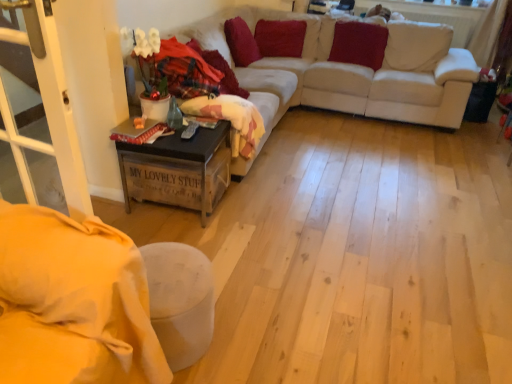
This screenshot has width=512, height=384. What do you see at coordinates (359, 44) in the screenshot? I see `velvet red pillow at upper right, the 1th pillow positioned from the right` at bounding box center [359, 44].

The width and height of the screenshot is (512, 384). What do you see at coordinates (230, 117) in the screenshot?
I see `fluffy pink blanket at center` at bounding box center [230, 117].

What do you see at coordinates (280, 37) in the screenshot? This screenshot has width=512, height=384. I see `velvet red pillow at upper center, the 2th pillow positioned from the left` at bounding box center [280, 37].

At what (x,y) coordinates should I click in order to perform the action: click on white plastic screen door at lower left. Please return your answer as a coordinate pair (x, y). This screenshot has height=384, width=512. Looking at the image, I should click on (47, 108).

Is white fabric couch at upper center bigger than velvet red pillow at upper center, which ranks as the second pillow in right-to-left order?

Yes, white fabric couch at upper center is bigger than velvet red pillow at upper center, which ranks as the second pillow in right-to-left order.

From a real-world perspective, is white fabric couch at upper center located higher than velvet red pillow at upper center, which ranks as the second pillow in right-to-left order?

No.

Between white fabric couch at upper center and velvet red pillow at upper center, the 2th pillow positioned from the left, which one has larger width?

With larger width is white fabric couch at upper center.

Is velvet red pillow at upper center, which is the 1th pillow in left-to-right order, far away from velvet red pillow at upper center, the 2th pillow positioned from the left?

No, velvet red pillow at upper center, which is the 1th pillow in left-to-right order, is in close proximity to velvet red pillow at upper center, the 2th pillow positioned from the left.

Considering the relative sizes of velvet red pillow at upper center, which appears as the 3th pillow when viewed from the right, and velvet red pillow at upper center, which ranks as the second pillow in right-to-left order, in the image provided, is velvet red pillow at upper center, which appears as the 3th pillow when viewed from the right, wider than velvet red pillow at upper center, which ranks as the second pillow in right-to-left order,?

No.

From a real-world perspective, count 2nd pillows downward from the velvet red pillow at upper center, which appears as the 3th pillow when viewed from the right, and point to it. Please provide its 2D coordinates.

[(280, 37)]

Can we say velvet red pillow at upper center, which ranks as the second pillow in right-to-left order, lies outside velvet red pillow at upper center, which is the 1th pillow in left-to-right order?

Indeed, velvet red pillow at upper center, which ranks as the second pillow in right-to-left order, is completely outside velvet red pillow at upper center, which is the 1th pillow in left-to-right order.

Is velvet red pillow at upper center, the 2th pillow positioned from the left, wider than velvet red pillow at upper center, which is the 1th pillow in left-to-right order?

Yes, velvet red pillow at upper center, the 2th pillow positioned from the left, is wider than velvet red pillow at upper center, which is the 1th pillow in left-to-right order.

Is velvet red pillow at upper center, which ranks as the second pillow in right-to-left order, shorter than velvet red pillow at upper center, which is the 1th pillow in left-to-right order?

Indeed, velvet red pillow at upper center, which ranks as the second pillow in right-to-left order, has a lesser height compared to velvet red pillow at upper center, which is the 1th pillow in left-to-right order.

Is velvet red pillow at upper center, the 2th pillow positioned from the left, further to the viewer compared to velvet red pillow at upper center, which is the 1th pillow in left-to-right order?

Yes, velvet red pillow at upper center, the 2th pillow positioned from the left, is further from the camera.

In the scene shown: Considering the sizes of wooden crate at lower left and velvet red pillow at upper center, which is the 1th pillow in left-to-right order, in the image, is wooden crate at lower left wider or thinner than velvet red pillow at upper center, which is the 1th pillow in left-to-right order,?

In the image, wooden crate at lower left appears to be wider than velvet red pillow at upper center, which is the 1th pillow in left-to-right order.

From a real-world perspective, between wooden crate at lower left and velvet red pillow at upper center, which is the 1th pillow in left-to-right order, who is vertically lower?

From a 3D spatial view, wooden crate at lower left is below.

How far apart are wooden crate at lower left and velvet red pillow at upper center, which is the 1th pillow in left-to-right order?

wooden crate at lower left is 5.85 feet from velvet red pillow at upper center, which is the 1th pillow in left-to-right order.

At what (x,y) coordinates should I click in order to perform the action: click on pillow that is the 2nd one when counting upward from the wooden crate at lower left (from the image's perspective). Please return your answer as a coordinate pair (x, y). This screenshot has width=512, height=384. Looking at the image, I should click on (241, 42).

Is point (190, 112) positioned behind point (245, 46)?

That is False.

How different are the orientations of fluffy pink blanket at center and velvet red pillow at upper center, which appears as the 3th pillow when viewed from the right, in degrees?

The angle between the facing direction of fluffy pink blanket at center and the facing direction of velvet red pillow at upper center, which appears as the 3th pillow when viewed from the right, is 1.87 degrees.

Considering the sizes of objects fluffy pink blanket at center and velvet red pillow at upper center, which is the 1th pillow in left-to-right order, in the image provided, who is shorter, fluffy pink blanket at center or velvet red pillow at upper center, which is the 1th pillow in left-to-right order,?

Standing shorter between the two is fluffy pink blanket at center.

Consider the image. Is fluffy pink blanket at center positioned with its back to velvet red pillow at upper center, which appears as the 3th pillow when viewed from the right?

fluffy pink blanket at center is not turned away from velvet red pillow at upper center, which appears as the 3th pillow when viewed from the right.

Is velvet red pillow at upper right, the 1th pillow positioned from the right, to the left of fluffy pink blanket at center from the viewer's perspective?

Incorrect, velvet red pillow at upper right, the 1th pillow positioned from the right, is not on the left side of fluffy pink blanket at center.

From a real-world perspective, is velvet red pillow at upper right, the 1th pillow positioned from the right, positioned above or below fluffy pink blanket at center?

In terms of real-world spatial position, velvet red pillow at upper right, the 1th pillow positioned from the right, is above fluffy pink blanket at center.

Between velvet red pillow at upper right, the 3th pillow in the left-to-right sequence, and fluffy pink blanket at center, which one has larger width?

fluffy pink blanket at center is wider.

Is point (344, 22) positioned before point (240, 128)?

No, (344, 22) is further to viewer.

Which is behind, velvet red pillow at upper right, the 1th pillow positioned from the right, or white fabric couch at upper center?

Positioned behind is velvet red pillow at upper right, the 1th pillow positioned from the right.

From a real-world perspective, who is located lower, velvet red pillow at upper right, the 1th pillow positioned from the right, or white fabric couch at upper center?

white fabric couch at upper center, from a real-world perspective.

Is velvet red pillow at upper right, the 3th pillow in the left-to-right sequence, next to white fabric couch at upper center and touching it?

No, velvet red pillow at upper right, the 3th pillow in the left-to-right sequence, is not making contact with white fabric couch at upper center.

Which point is more distant from viewer, (353, 40) or (381, 75)?

Positioned behind is point (353, 40).

Locate an element on the screen. Image resolution: width=512 pixels, height=384 pixels. couch below the velvet red pillow at upper center, which ranks as the second pillow in right-to-left order (from a real-world perspective) is located at coordinates (360, 69).

You are a GUI agent. You are given a task and a screenshot of the screen. Output one action in this format:
    pyautogui.click(x=<x>, y=<y>)
    Task: Click on the pillow that is the 2nd one when counting forward from the velvet red pillow at upper center, which ranks as the second pillow in right-to-left order
    The width and height of the screenshot is (512, 384).
    Given the screenshot: What is the action you would take?
    pyautogui.click(x=241, y=42)

Considering their positions, is white plastic screen door at lower left positioned closer to wooden crate at lower left than fluffy pink blanket at center?

fluffy pink blanket at center is closer to wooden crate at lower left.

Which object lies further to the anchor point wooden crate at lower left, velvet red pillow at upper center, which ranks as the second pillow in right-to-left order, or white plastic screen door at lower left?

Among the two, velvet red pillow at upper center, which ranks as the second pillow in right-to-left order, is located further to wooden crate at lower left.

From the image, which object appears to be farther from fluffy pink blanket at center, white plastic screen door at lower left or wooden crate at lower left?

white plastic screen door at lower left.

Based on their spatial positions, is velvet red pillow at upper center, which appears as the 3th pillow when viewed from the right, or velvet red pillow at upper right, the 3th pillow in the left-to-right sequence, further from velvet red pillow at upper center, the 2th pillow positioned from the left?

velvet red pillow at upper right, the 3th pillow in the left-to-right sequence, is positioned further to the anchor velvet red pillow at upper center, the 2th pillow positioned from the left.

Which object lies nearer to the anchor point velvet red pillow at upper right, the 1th pillow positioned from the right, velvet red pillow at upper center, the 2th pillow positioned from the left, or white fabric couch at upper center?

white fabric couch at upper center is closer to velvet red pillow at upper right, the 1th pillow positioned from the right.

Estimate the real-world distances between objects in this image. Which object is closer to velvet red pillow at upper center, which appears as the 3th pillow when viewed from the right, white plastic screen door at lower left or velvet red pillow at upper right, the 3th pillow in the left-to-right sequence?

velvet red pillow at upper right, the 3th pillow in the left-to-right sequence.

When comparing their distances from white plastic screen door at lower left, does velvet red pillow at upper center, which ranks as the second pillow in right-to-left order, or white fabric couch at upper center seem further?

Based on the image, velvet red pillow at upper center, which ranks as the second pillow in right-to-left order, appears to be further to white plastic screen door at lower left.

Looking at the image, which one is located further to velvet red pillow at upper right, the 1th pillow positioned from the right, velvet red pillow at upper center, which appears as the 3th pillow when viewed from the right, or white plastic screen door at lower left?

white plastic screen door at lower left is further to velvet red pillow at upper right, the 1th pillow positioned from the right.

Where is `couch between wooden crate at lower left and velvet red pillow at upper center, the 2th pillow positioned from the left, from front to back`? Image resolution: width=512 pixels, height=384 pixels. couch between wooden crate at lower left and velvet red pillow at upper center, the 2th pillow positioned from the left, from front to back is located at coordinates (360, 69).

You are a GUI agent. You are given a task and a screenshot of the screen. Output one action in this format:
    pyautogui.click(x=<x>, y=<y>)
    Task: Click on the blanket between wooden crate at lower left and velvet red pillow at upper right, the 3th pillow in the left-to-right sequence, in the front-back direction
    The image size is (512, 384).
    Given the screenshot: What is the action you would take?
    pyautogui.click(x=230, y=117)

Locate an element on the screen. The height and width of the screenshot is (384, 512). table between white plastic screen door at lower left and white fabric couch at upper center in the front-back direction is located at coordinates (176, 169).

The image size is (512, 384). Find the location of `couch located between wooden crate at lower left and velvet red pillow at upper right, the 3th pillow in the left-to-right sequence, in the depth direction`. couch located between wooden crate at lower left and velvet red pillow at upper right, the 3th pillow in the left-to-right sequence, in the depth direction is located at coordinates click(x=360, y=69).